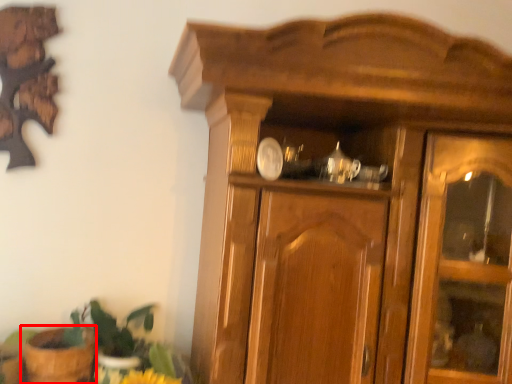
Question: From the image's perspective, what is the correct spatial relationship of flowerpot (annotated by the red box) in relation to houseplant?

Choices:
 (A) below
 (B) above

Answer: (A)